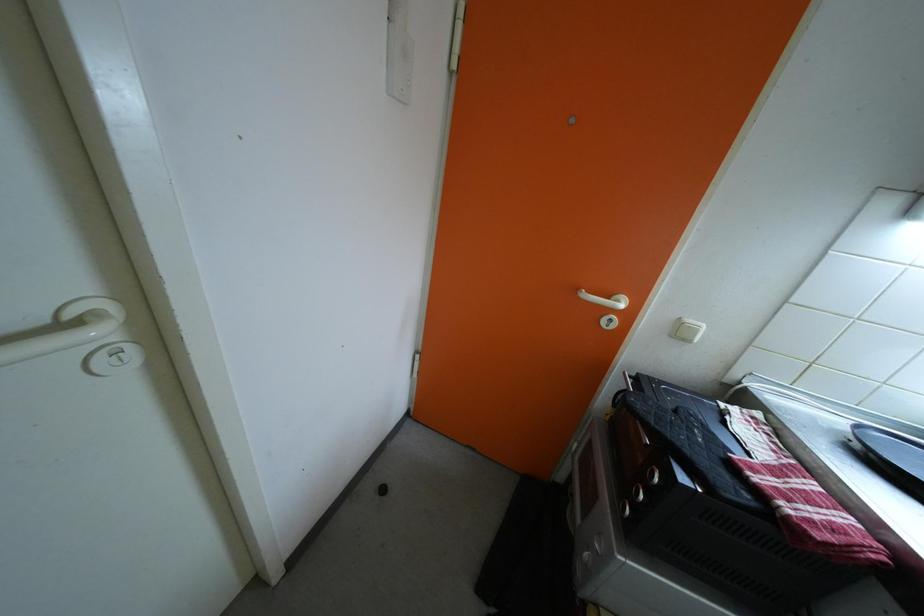
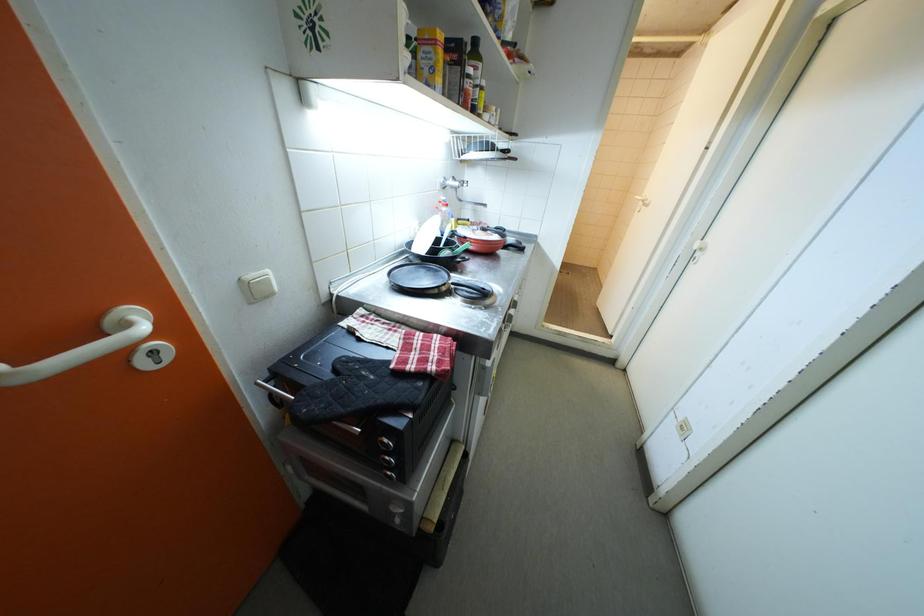
The first image is from the beginning of the video and the second image is from the end. How did the camera likely rotate when shooting the video?

The rotation direction of the camera is right-down.